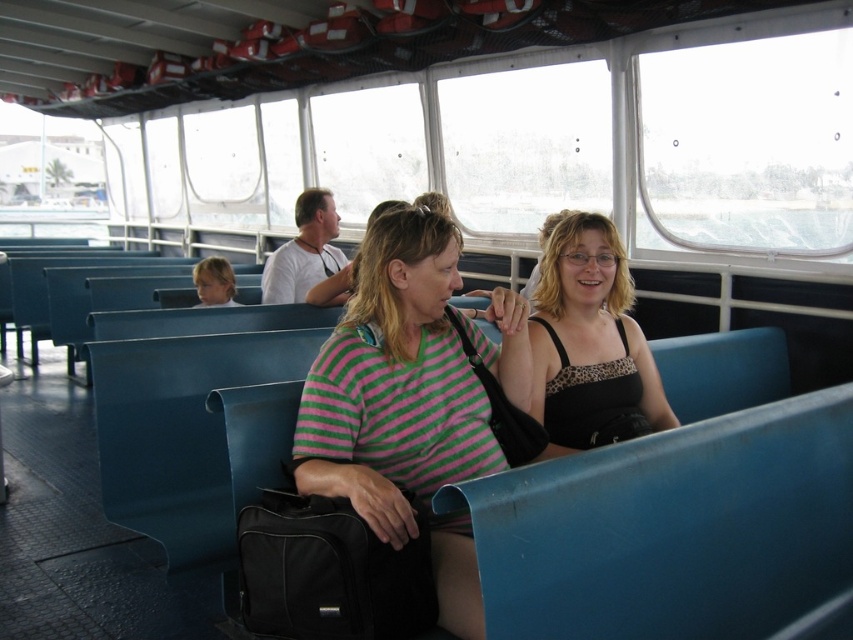
You are a photographer trying to capture a closeup of both the striped cotton shirt at center and the leopard print tank top at center in the ferry cabin. Given the limited space between them, can you fit both subjects in the frame without moving either of them?

The striped cotton shirt at center is 18.80 inches from the leopard print tank top at center. Depending on the camera lens and framing, it should be possible to capture both subjects in the same frame as the distance between them is relatively close.

From the picture: You are a photographer taking a picture of the leopard print tank top at center and the blonde hair at left. Which object will appear larger in the photo?

The leopard print tank top at center will appear larger in the photo because it is bigger than the blonde hair at left.